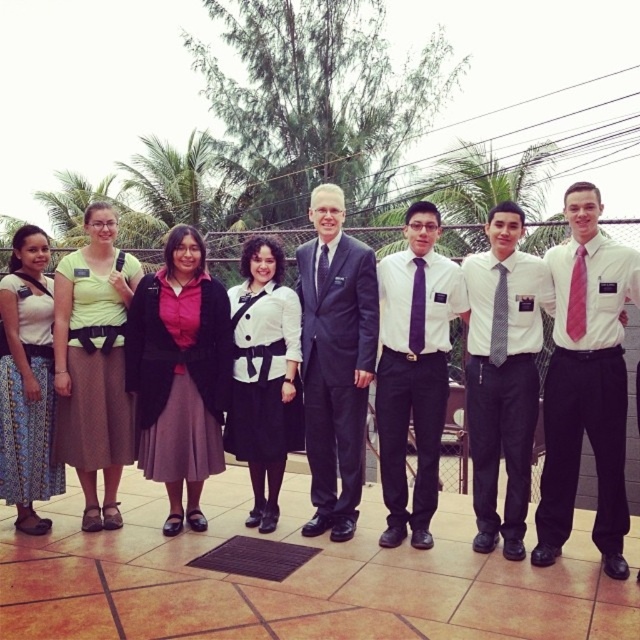
Question: Estimate the real-world distances between objects in this image. Which object is closer to the pink tie at right?

Choices:
 (A) pink silk tie at center
 (B) purple tie at center
 (C) gray silk tie at center

Answer: (A)

Question: Which is farther from the purple satin tie at center?

Choices:
 (A) dark blue suit at center
 (B) gray silk tie at center
 (C) printed cotton skirt at lower left
 (D) matte pink shirt at center

Answer: (C)

Question: Is the position of matte pink shirt at center less distant than that of gray silk tie at center?

Choices:
 (A) yes
 (B) no

Answer: (B)

Question: Which object is the closest to the white matte dress at center?

Choices:
 (A) purple silk tie at center
 (B) pink tie at right

Answer: (A)

Question: Is gray silk tie at center smaller than purple silk tie at center?

Choices:
 (A) yes
 (B) no

Answer: (B)

Question: Considering the relative positions of purple tie at center and matte yellow-green shirt at center in the image provided, where is purple tie at center located with respect to matte yellow-green shirt at center?

Choices:
 (A) below
 (B) above

Answer: (A)